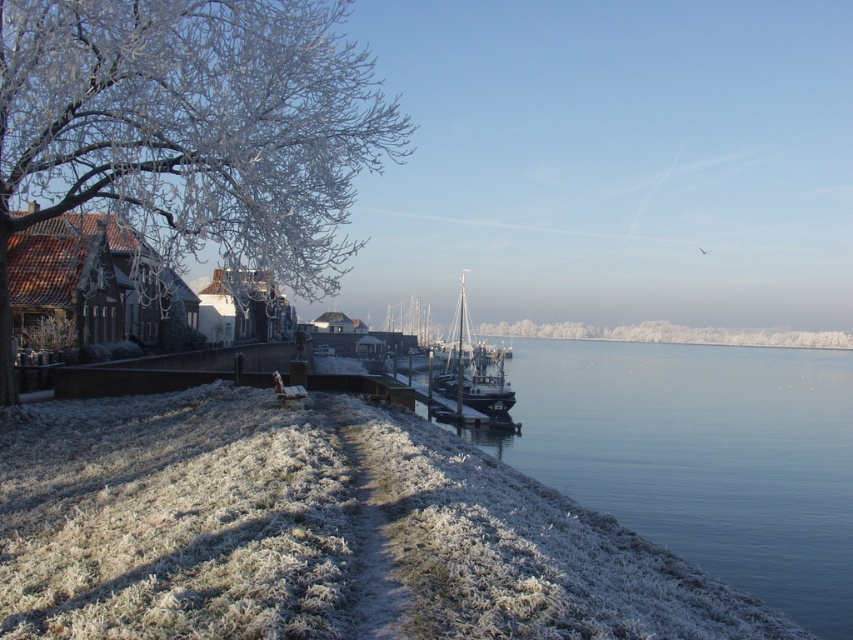
You are standing at the wooden bench near the water and want to find the blue glassy water at lower left. According to the scene, where should you look relative to the bench?

The blue glassy water at lower left is located at point (701, 456), so you should look towards the lower left direction from the bench to find it.

Consider the image. You are standing at the camera position and want to take a photo of the frosted glass tree at left. If your camera has a maximum focus range of 40 feet, will you be able to focus on the tree?

The frosted glass tree at left is 45.38 feet away from the camera, which exceeds the maximum focus range of 40 feet. Therefore, the camera cannot focus on the tree.

You are an artist planning to paint this winter scene. You need to decide which object, the frosted glass tree at left or the blue glassy water at lower left, requires more detail in the painting. Based on their thickness, which should you focus on more?

The frosted glass tree at left is thinner than the blue glassy water at lower left, so you should focus more detail on the blue glassy water at lower left to accurately represent its broader form.